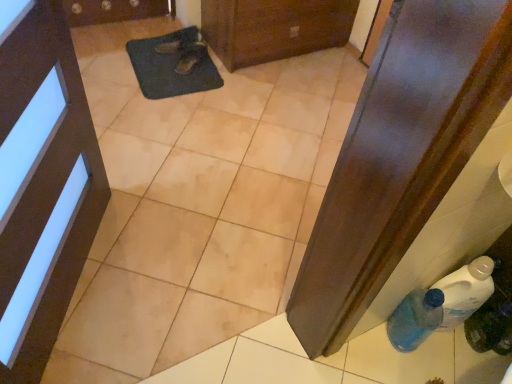
Question: Does black leather shoe at upper center, positioned as the second footwear in bottom-to-top order, have a lesser height compared to blue translucent bottle at lower right, which ranks as the 1th bottle in left-to-right order?

Choices:
 (A) yes
 (B) no

Answer: (A)

Question: From the image's perspective, is black leather shoe at upper center, which is counted as the first footwear, starting from the top, on top of blue translucent bottle at lower right, the 2th bottle positioned from the right?

Choices:
 (A) yes
 (B) no

Answer: (A)

Question: Is black leather shoe at upper center, which is counted as the first footwear, starting from the top, positioned in front of blue translucent bottle at lower right, the 2th bottle positioned from the right?

Choices:
 (A) no
 (B) yes

Answer: (A)

Question: Can you confirm if black leather shoe at upper center, positioned as the second footwear in bottom-to-top order, is positioned to the right of blue translucent bottle at lower right, which ranks as the 1th bottle in left-to-right order?

Choices:
 (A) yes
 (B) no

Answer: (B)

Question: Does black leather shoe at upper center, which is counted as the first footwear, starting from the top, have a lesser width compared to blue translucent bottle at lower right, the 2th bottle positioned from the right?

Choices:
 (A) no
 (B) yes

Answer: (A)

Question: In the image, is brown leather shoe at center, acting as the first footwear starting from the bottom, positioned in front of or behind blue translucent bottle at lower right, positioned as the second bottle in left-to-right order?

Choices:
 (A) front
 (B) behind

Answer: (B)

Question: Considering the positions of brown leather shoe at center, acting as the first footwear starting from the bottom, and blue translucent bottle at lower right, positioned as the second bottle in left-to-right order, in the image, is brown leather shoe at center, acting as the first footwear starting from the bottom, taller or shorter than blue translucent bottle at lower right, positioned as the second bottle in left-to-right order,?

Choices:
 (A) short
 (B) tall

Answer: (A)

Question: Choose the correct answer: Is brown leather shoe at center, acting as the first footwear starting from the bottom, inside blue translucent bottle at lower right, which is the first bottle from right to left, or outside it?

Choices:
 (A) inside
 (B) outside

Answer: (B)

Question: From a real-world perspective, is brown leather shoe at center, the 2th footwear in the top-to-bottom sequence, physically located above or below blue translucent bottle at lower right, positioned as the second bottle in left-to-right order?

Choices:
 (A) above
 (B) below

Answer: (B)

Question: Based on their sizes in the image, would you say brown leather shoe at center, acting as the first footwear starting from the bottom, is bigger or smaller than matte black door at upper left, which is the first door from bottom to top?

Choices:
 (A) small
 (B) big

Answer: (A)

Question: From the image's perspective, is brown leather shoe at center, acting as the first footwear starting from the bottom, located above or below matte black door at upper left, marked as the 1th door in a left-to-right arrangement?

Choices:
 (A) below
 (B) above

Answer: (B)

Question: Is brown leather shoe at center, acting as the first footwear starting from the bottom, taller or shorter than matte black door at upper left, marked as the 1th door in a left-to-right arrangement?

Choices:
 (A) tall
 (B) short

Answer: (B)

Question: In terms of width, does brown leather shoe at center, the 2th footwear in the top-to-bottom sequence, look wider or thinner when compared to matte black door at upper left, positioned as the second door in right-to-left order?

Choices:
 (A) thin
 (B) wide

Answer: (B)

Question: In terms of size, does blue translucent bottle at lower right, positioned as the second bottle in left-to-right order, appear bigger or smaller than brown wooden door at upper center, placed as the 2th door when sorted from front to back?

Choices:
 (A) small
 (B) big

Answer: (A)

Question: From the image's perspective, relative to brown wooden door at upper center, which ranks as the 1th door in top-to-bottom order, is blue translucent bottle at lower right, which is the first bottle from right to left, above or below?

Choices:
 (A) above
 (B) below

Answer: (B)